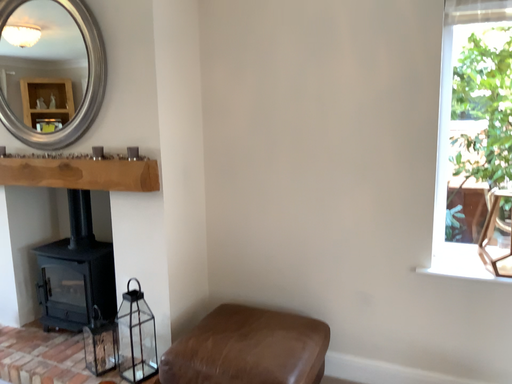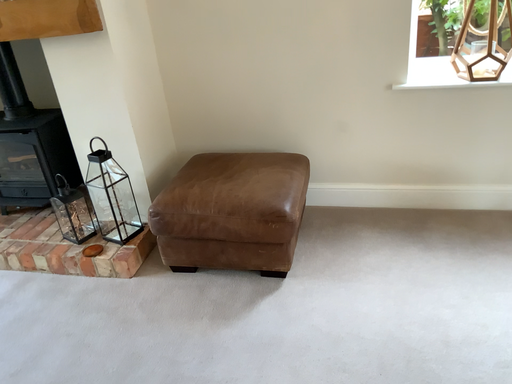
Question: How did the camera likely rotate when shooting the video?

Choices:
 (A) rotated upward
 (B) rotated downward

Answer: (B)